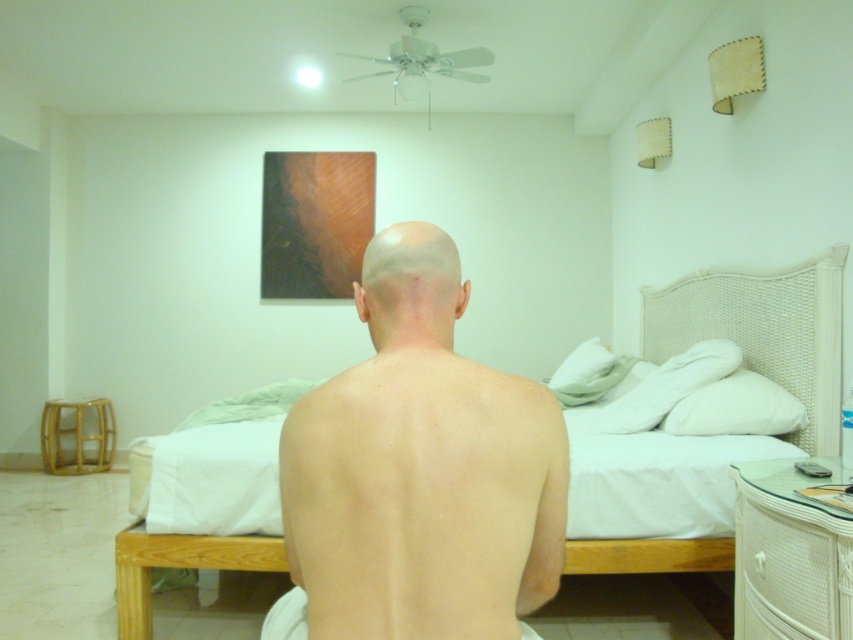
Which is behind, point (228, 538) or point (387, 339)?

The point (228, 538) is behind.

Which is more to the right, white woven bed at center or smooth skin at center?

From the viewer's perspective, white woven bed at center appears more on the right side.

Is point (621, 570) farther from viewer compared to point (457, 257)?

That is True.

The image size is (853, 640). Identify the location of white woven bed at center. (764, 330).

Which of these two, skinny bald man at center or white woven bed at center, stands shorter?

Standing shorter between the two is skinny bald man at center.

Which is in front, point (297, 445) or point (651, 301)?

Point (297, 445) is more forward.

Where is `skinny bald man at center`? This screenshot has width=853, height=640. skinny bald man at center is located at coordinates (421, 468).

Is point (769, 500) positioned behind point (384, 288)?

Yes, point (769, 500) is behind point (384, 288).

Does white wicker dresser at lower right have a greater height compared to smooth skin at center?

Yes, white wicker dresser at lower right is taller than smooth skin at center.

Is point (770, 540) closer to camera compared to point (399, 243)?

No, it is behind (399, 243).

The width and height of the screenshot is (853, 640). I want to click on white wicker dresser at lower right, so click(x=787, y=557).